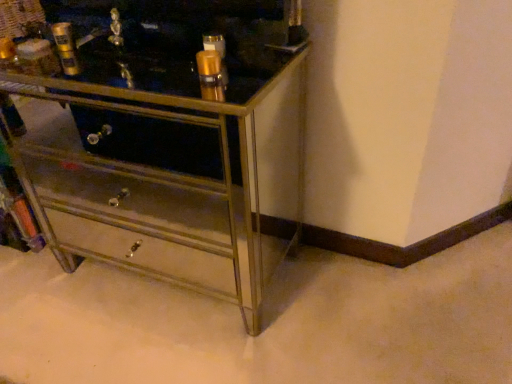
Question: Should I look upward or downward to see metallic mirrored chest of drawers at center?

Choices:
 (A) down
 (B) up

Answer: (B)